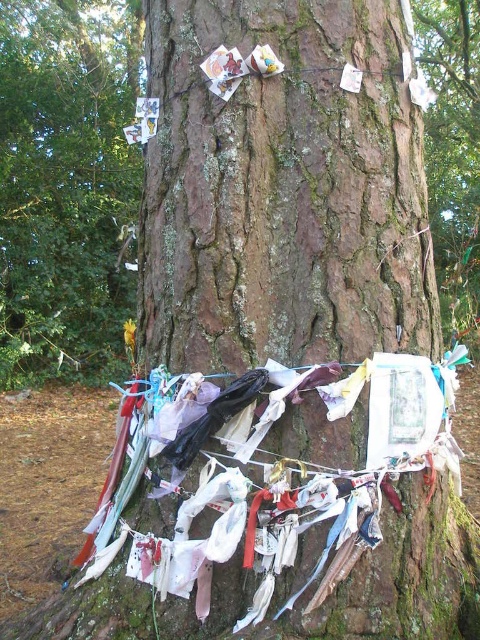
Who is shorter, rough bark tree at upper center or multicolored fabric at center?

With less height is multicolored fabric at center.

Is rough bark tree at upper center shorter than multicolored fabric at center?

No.

Does point (60, 65) come closer to viewer compared to point (394, 376)?

No, it is not.

Where is `rough bark tree at upper center`? The image size is (480, 640). rough bark tree at upper center is located at coordinates (67, 186).

Who is positioned more to the left, brown rough bark at center or multicolored fabric at center?

Positioned to the left is brown rough bark at center.

Which is above, brown rough bark at center or multicolored fabric at center?

brown rough bark at center is above.

Who is more forward, (408, 198) or (154, 632)?

Point (154, 632) is in front.

The height and width of the screenshot is (640, 480). In order to click on brown rough bark at center in this screenshot , I will do `click(283, 192)`.

Does point (402, 612) lie behind point (72, 296)?

No, it is in front of (72, 296).

Between point (384, 58) and point (29, 192), which one is positioned behind?

Positioned behind is point (29, 192).

I want to click on brown rough bark at center, so click(283, 192).